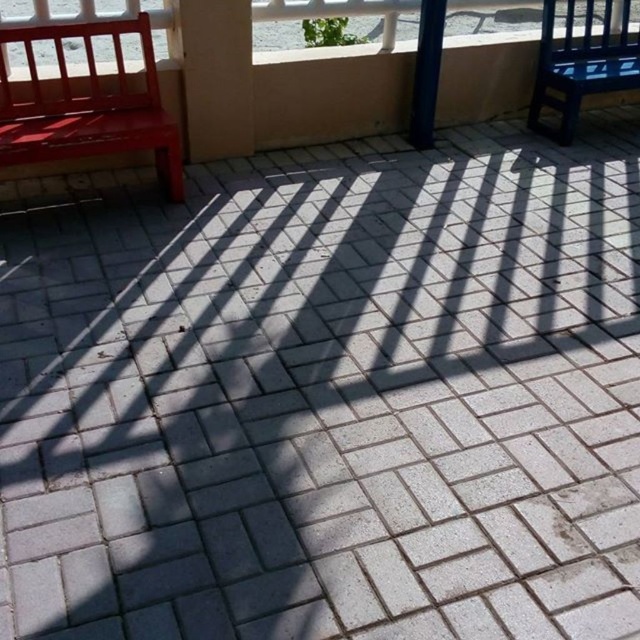
Does matte red bench at left lie in front of blue glossy chair at right?

Yes, matte red bench at left is closer to the viewer.

Does matte red bench at left have a lesser height compared to blue glossy chair at right?

Correct, matte red bench at left is not as tall as blue glossy chair at right.

The height and width of the screenshot is (640, 640). What do you see at coordinates (86, 104) in the screenshot?
I see `matte red bench at left` at bounding box center [86, 104].

Where is `matte red bench at left`? matte red bench at left is located at coordinates (86, 104).